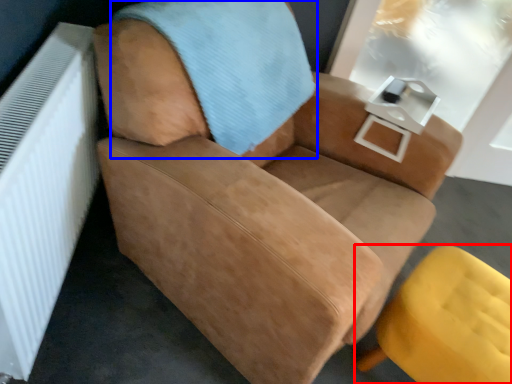
Question: Which object appears closest to the camera in this image, chair (highlighted by a red box) or blanket (highlighted by a blue box)?

Choices:
 (A) chair
 (B) blanket

Answer: (B)